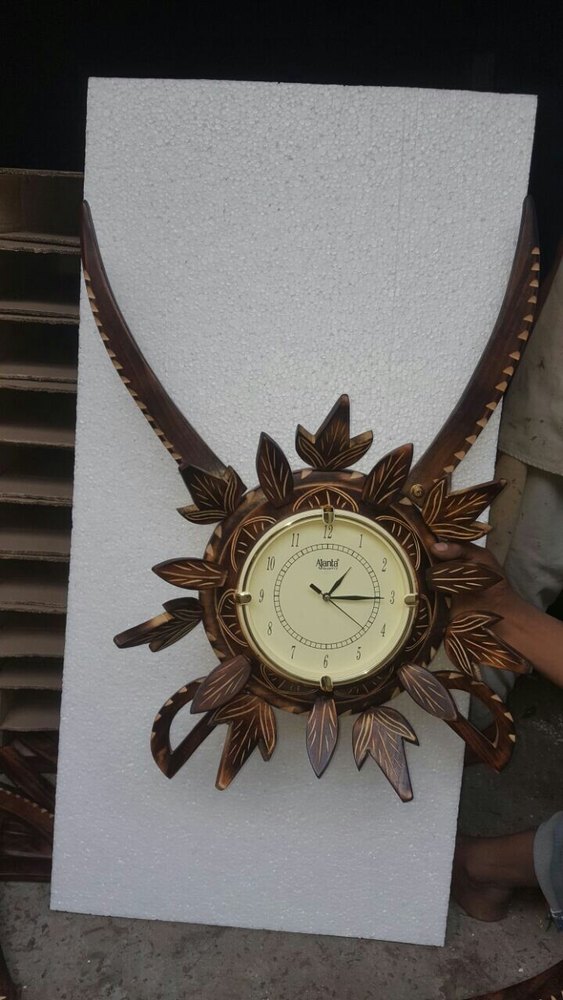
The width and height of the screenshot is (563, 1000). Identify the location of grey floor. (120, 969).